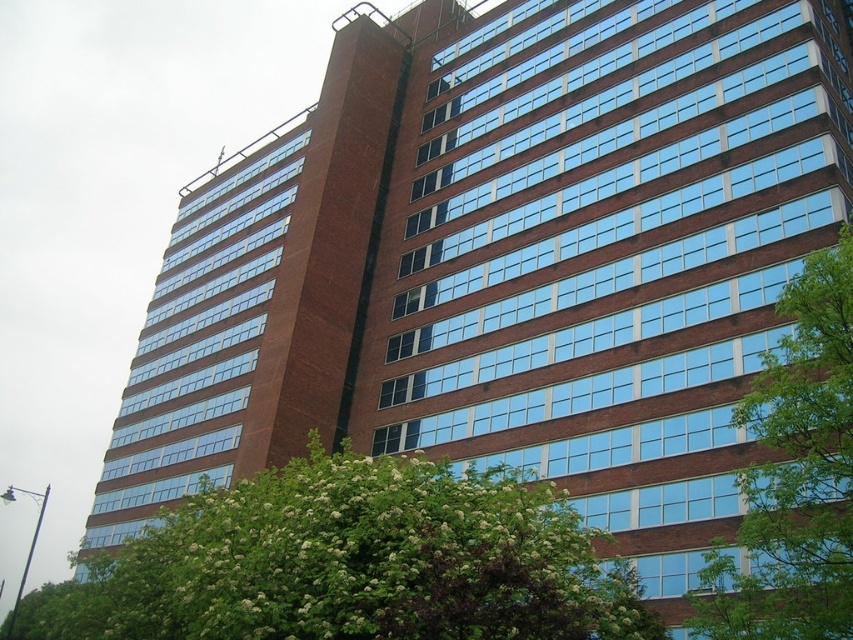
You are a landscape architect designing a garden path between the green leafy tree at lower left and the green leafy tree at right. Based on their widths, which tree might require more space to avoid being overcrowded?

The green leafy tree at lower left might require more space since it is wider than the green leafy tree at right according to the description.

You are standing in front of the modern building and want to take a photo of both the green leafy tree at lower left and the green leafy tree at right. Which tree should you position closer to the building to include both in your frame?

The green leafy tree at lower left is positioned under the green leafy tree at right. To include both in your frame, you should position the green leafy tree at lower left closer to the building since it is behind the green leafy tree at right.